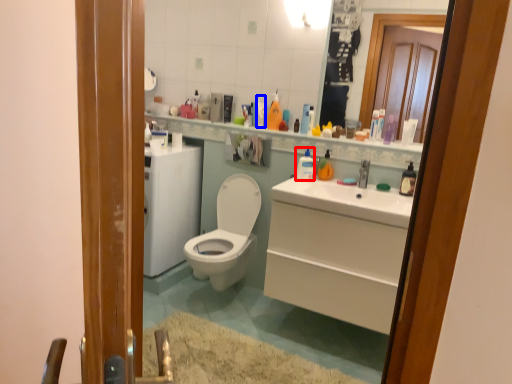
Question: Which object is further to the camera taking this photo, cleaning product (highlighted by a red box) or toiletry (highlighted by a blue box)?

Choices:
 (A) cleaning product
 (B) toiletry

Answer: (B)